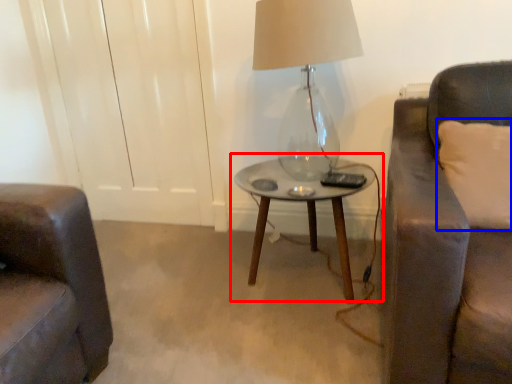
Question: Among these objects, which one is farthest to the camera, table (highlighted by a red box) or pillow (highlighted by a blue box)?

Choices:
 (A) table
 (B) pillow

Answer: (A)